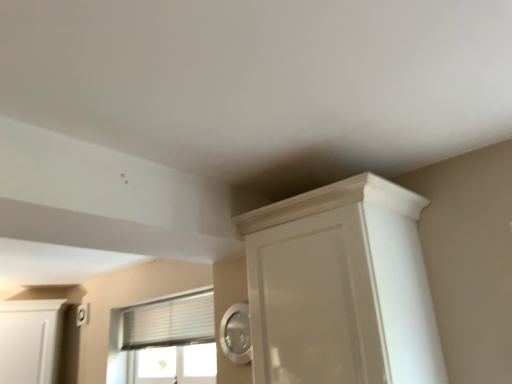
Question: Considering the relative sizes of white glossy cupboard at upper right and white matte cabinet at left in the image provided, is white glossy cupboard at upper right bigger than white matte cabinet at left?

Choices:
 (A) no
 (B) yes

Answer: (B)

Question: Is white glossy cupboard at upper right smaller than white matte cabinet at left?

Choices:
 (A) no
 (B) yes

Answer: (A)

Question: Is white glossy cupboard at upper right positioned with its back to white matte cabinet at left?

Choices:
 (A) no
 (B) yes

Answer: (A)

Question: Considering the relative sizes of white glossy cupboard at upper right and white matte cabinet at left in the image provided, is white glossy cupboard at upper right thinner than white matte cabinet at left?

Choices:
 (A) no
 (B) yes

Answer: (A)

Question: From the image's perspective, is white glossy cupboard at upper right on white matte cabinet at left?

Choices:
 (A) no
 (B) yes

Answer: (B)

Question: Is white glossy cupboard at upper right not near white matte cabinet at left?

Choices:
 (A) yes
 (B) no

Answer: (A)

Question: Considering the relative positions of white textured window at center and white glossy cupboard at upper right in the image provided, is white textured window at center in front of white glossy cupboard at upper right?

Choices:
 (A) no
 (B) yes

Answer: (A)

Question: Is white textured window at center next to white glossy cupboard at upper right and touching it?

Choices:
 (A) no
 (B) yes

Answer: (A)

Question: Does white textured window at center come behind white glossy cupboard at upper right?

Choices:
 (A) no
 (B) yes

Answer: (B)

Question: Can you confirm if white textured window at center is bigger than white glossy cupboard at upper right?

Choices:
 (A) yes
 (B) no

Answer: (B)

Question: From a real-world perspective, is white textured window at center positioned over white glossy cupboard at upper right based on gravity?

Choices:
 (A) no
 (B) yes

Answer: (B)

Question: Considering the relative sizes of white textured window at center and white glossy cupboard at upper right in the image provided, is white textured window at center taller than white glossy cupboard at upper right?

Choices:
 (A) yes
 (B) no

Answer: (B)

Question: From the image's perspective, is white glossy cupboard at upper right on white textured window at center?

Choices:
 (A) no
 (B) yes

Answer: (B)